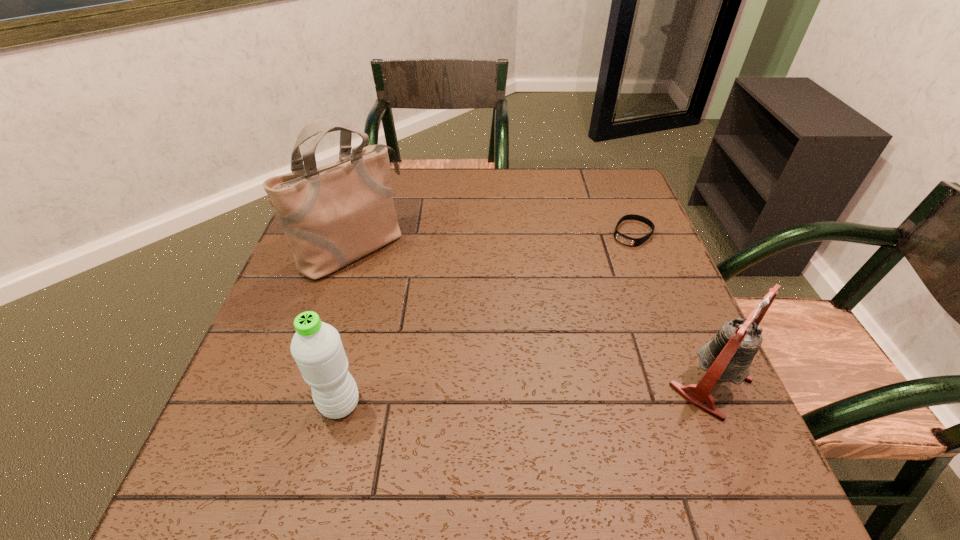
This screenshot has width=960, height=540. Identify the location of water bottle. (317, 348).

Where is `bell`? This screenshot has height=540, width=960. bell is located at coordinates (727, 357).

Find the location of `wristband`. wristband is located at coordinates (632, 242).

Where is `the tallest object`? the tallest object is located at coordinates (333, 215).

At what (x,y) coordinates should I click in order to perform the action: click on vacant space located 0.070m on the back of the water bottle. Please return your answer as a coordinate pair (x, y). Looking at the image, I should click on (352, 356).

The image size is (960, 540). I want to click on vacant area situated 0.140m on the back of the bell, so click(x=674, y=299).

Identify the location of free location located on the display of the wristband. This screenshot has height=540, width=960. (540, 338).

The height and width of the screenshot is (540, 960). What are the coordinates of `vacant space located on the display of the wristband` in the screenshot? It's located at (577, 297).

This screenshot has height=540, width=960. What are the coordinates of `vacant space located 0.350m on the display of the wristband` in the screenshot? It's located at (550, 326).

Identify the location of vacant area situated on the front-facing side of the shoulder bag. The image size is (960, 540). (451, 331).